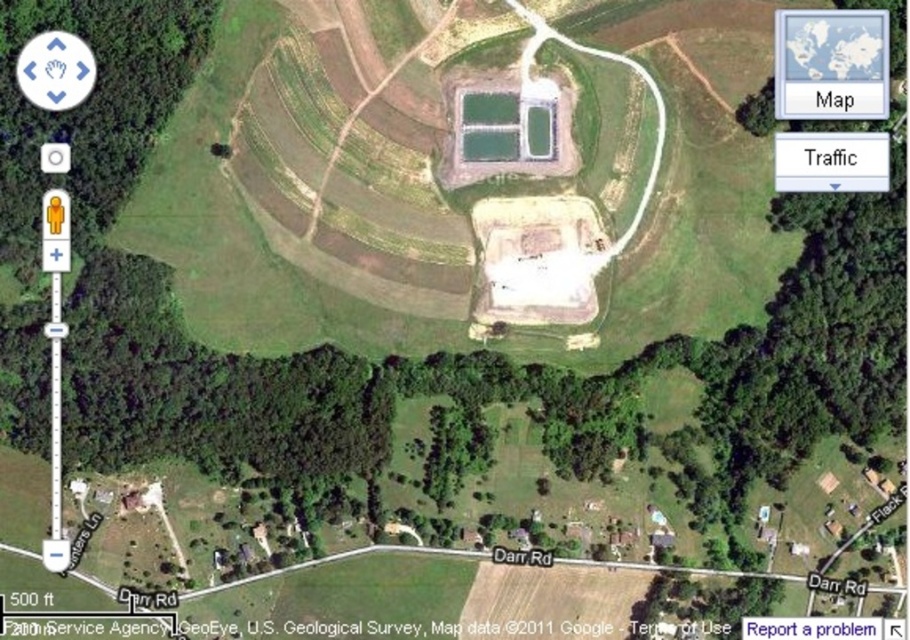
Question: Does gray plastic map at upper right appear over white text on blue button at bottom right?

Choices:
 (A) yes
 (B) no

Answer: (A)

Question: Which object is closer to the camera taking this photo?

Choices:
 (A) white text on blue button at bottom right
 (B) gray plastic map at upper right

Answer: (A)

Question: Considering the relative positions of gray plastic map at upper right and white text on blue button at bottom right in the image provided, where is gray plastic map at upper right located with respect to white text on blue button at bottom right?

Choices:
 (A) below
 (B) above

Answer: (B)

Question: Which point is farther to the camera?

Choices:
 (A) gray plastic map at upper right
 (B) white text on blue button at bottom right

Answer: (A)

Question: Among these points, which one is nearest to the camera?

Choices:
 (A) (814, 12)
 (B) (851, 621)

Answer: (B)

Question: Can you confirm if gray plastic map at upper right is bigger than white text on blue button at bottom right?

Choices:
 (A) yes
 (B) no

Answer: (A)